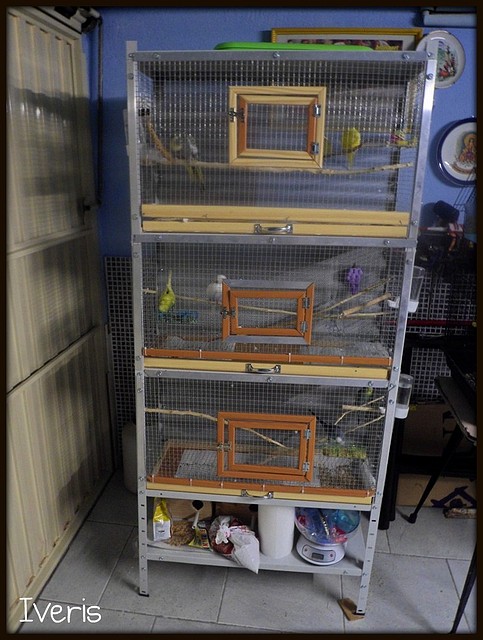
This screenshot has height=640, width=483. Identify the location of floor. (234, 611).